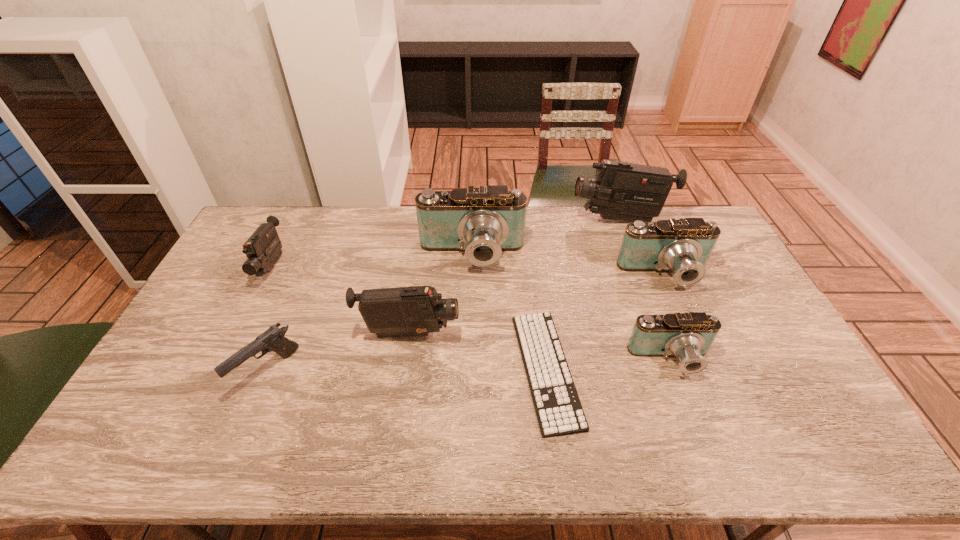
Identify which object is the seventh closest to the smallest blue camcorder. Please provide its 2D coordinates. Your answer should be formatted as a tuple, i.e. [(x, y)], where the tuple contains the x and y coordinates of a point satisfying the conditions above.

[(263, 248)]

Locate an element on the screen. The width and height of the screenshot is (960, 540). the fifth closest camcorder relative to the second biggest blue camcorder is located at coordinates (263, 248).

The image size is (960, 540). I want to click on camcorder that stands as the closest to the black gun, so click(x=403, y=311).

What are the coordinates of `black camcorder that is the second closest to the seventh object from right to left` in the screenshot? It's located at (263, 248).

Locate which black camcorder ranks second in proximity to the leftmost camcorder. Please provide its 2D coordinates. Your answer should be formatted as a tuple, i.e. [(x, y)], where the tuple contains the x and y coordinates of a point satisfying the conditions above.

[(624, 191)]

This screenshot has width=960, height=540. What are the coordinates of `blue camcorder that is the second closest to the leftmost object` in the screenshot? It's located at (688, 336).

Find the location of a particular element. The image size is (960, 540). blue camcorder that is the nearest to the second object from left to right is located at coordinates (483, 222).

At what (x,y) coordinates should I click in order to perform the action: click on vacant space that satisfies the following two spatial constraints: 1. on the front-facing side of the rightmost black camcorder; 2. on the front-facing side of the smallest black camcorder. Please return your answer as a coordinate pair (x, y). This screenshot has height=540, width=960. Looking at the image, I should click on (636, 267).

This screenshot has height=540, width=960. In order to click on free space that satisfies the following two spatial constraints: 1. on the front-facing side of the farthest camcorder; 2. on the front side of the shortest object in this screenshot , I will do `click(676, 369)`.